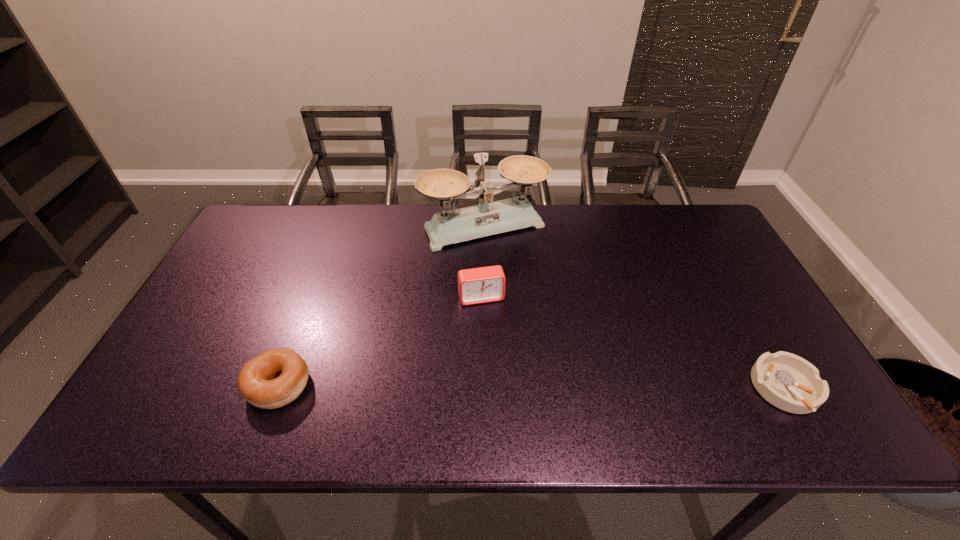
This screenshot has width=960, height=540. I want to click on vacant area situated on the front-facing side of the alarm clock, so click(501, 364).

The width and height of the screenshot is (960, 540). Identify the location of vacant area located 0.180m on the front-facing side of the alarm clock. (500, 361).

Image resolution: width=960 pixels, height=540 pixels. Find the location of `free region located 0.120m on the front-facing side of the alarm clock`. free region located 0.120m on the front-facing side of the alarm clock is located at coordinates (494, 341).

Where is `vacant space located on the front-facing side of the scale`? vacant space located on the front-facing side of the scale is located at coordinates (555, 331).

You are a GUI agent. You are given a task and a screenshot of the screen. Output one action in this format:
    pyautogui.click(x=<x>, y=<y>)
    Task: Click on the free space located on the front-facing side of the scale
    
    Given the screenshot: What is the action you would take?
    pyautogui.click(x=565, y=349)

Where is `vacant region located 0.300m on the front-facing side of the scale`? vacant region located 0.300m on the front-facing side of the scale is located at coordinates (548, 320).

This screenshot has height=540, width=960. In order to click on object situated at the far edge in this screenshot , I will do `click(488, 218)`.

Where is `bagel at the near edge`? This screenshot has height=540, width=960. bagel at the near edge is located at coordinates (256, 383).

Identify the location of ashtray present at the near edge. The width and height of the screenshot is (960, 540). (787, 381).

Locate an element on the screen. This screenshot has width=960, height=540. object that is at the right edge is located at coordinates (787, 381).